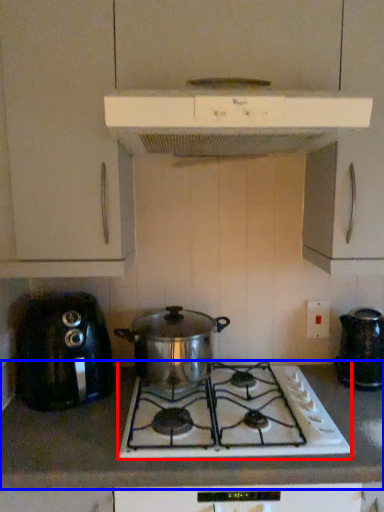
Question: Which object is closer to the camera taking this photo, gas stove (highlighted by a red box) or countertop (highlighted by a blue box)?

Choices:
 (A) gas stove
 (B) countertop

Answer: (B)